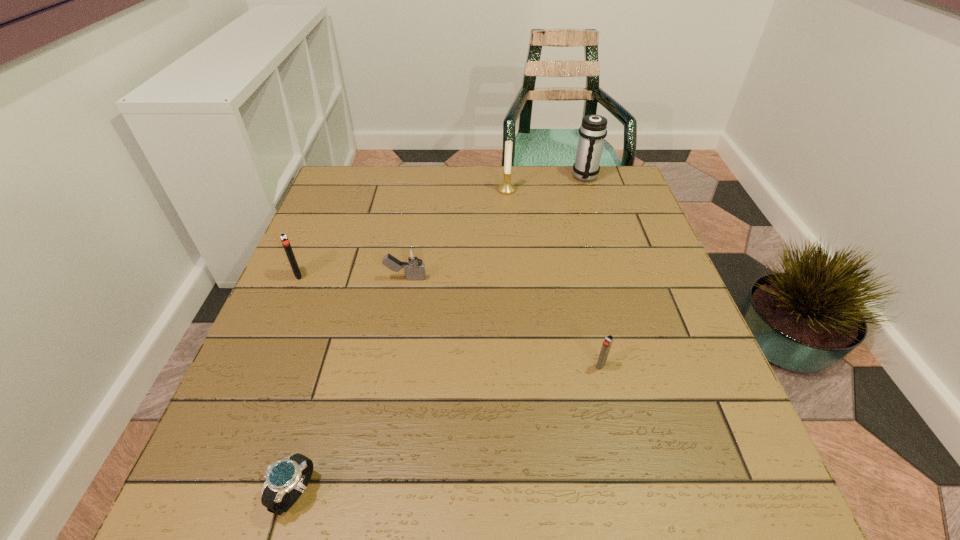
The width and height of the screenshot is (960, 540). In order to click on vacant region between the third object from left to right and the nearest object in this screenshot , I will do `click(350, 385)`.

Find the location of `unoccupied area between the tallest igniter and the shortest object`. unoccupied area between the tallest igniter and the shortest object is located at coordinates (297, 384).

The width and height of the screenshot is (960, 540). What are the coordinates of `empty location between the rightmost object and the second igniter from left to right` in the screenshot? It's located at (495, 227).

At what (x,y) coordinates should I click in order to perform the action: click on unoccupied position between the nearest object and the nearest igniter. Please return your answer as a coordinate pair (x, y). This screenshot has width=960, height=540. Looking at the image, I should click on (448, 429).

Identify the location of vacant area that lies between the third object from left to right and the third tallest object. (352, 276).

Find the location of a particular element. Image resolution: width=960 pixels, height=540 pixels. vacant area that lies between the second igniter from left to right and the thermos bottle is located at coordinates [495, 227].

The image size is (960, 540). I want to click on free spot between the second igniter from right to left and the fifth shortest object, so click(x=456, y=234).

The width and height of the screenshot is (960, 540). I want to click on free space between the second object from left to right and the candle holder, so click(x=401, y=341).

This screenshot has height=540, width=960. I want to click on free spot between the third object from right to left and the leftmost object, so click(402, 232).

At what (x,y) coordinates should I click in order to perform the action: click on free point between the rightmost object and the nearest igniter. Please return your answer as a coordinate pair (x, y). This screenshot has width=960, height=540. Looking at the image, I should click on (593, 271).